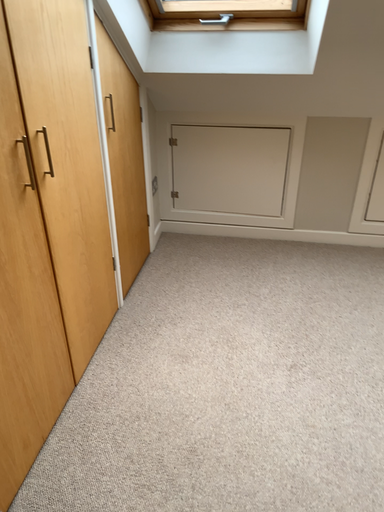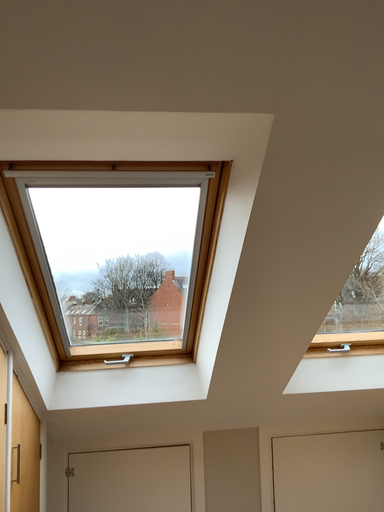
Question: Which way did the camera rotate in the video?

Choices:
 (A) rotated right
 (B) rotated left

Answer: (A)